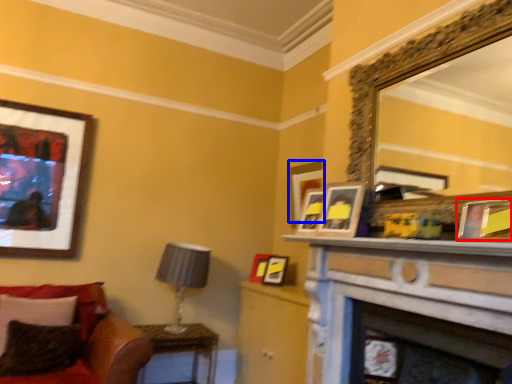
Question: Among these objects, which one is farthest to the camera, picture frame (highlighted by a red box) or picture frame (highlighted by a blue box)?

Choices:
 (A) picture frame
 (B) picture frame

Answer: (B)